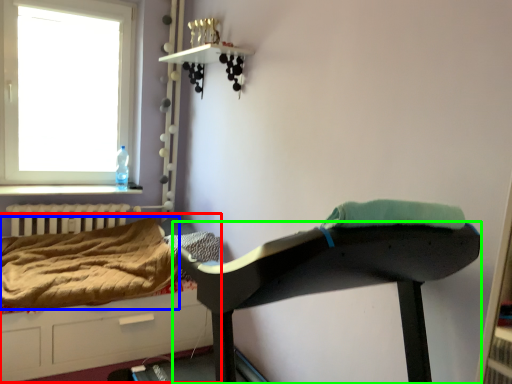
Question: Estimate the real-world distances between objects in this image. Which object is farther from hospital bed (highlighted by a red box), blanket (highlighted by a blue box) or furniture (highlighted by a green box)?

Choices:
 (A) blanket
 (B) furniture

Answer: (B)